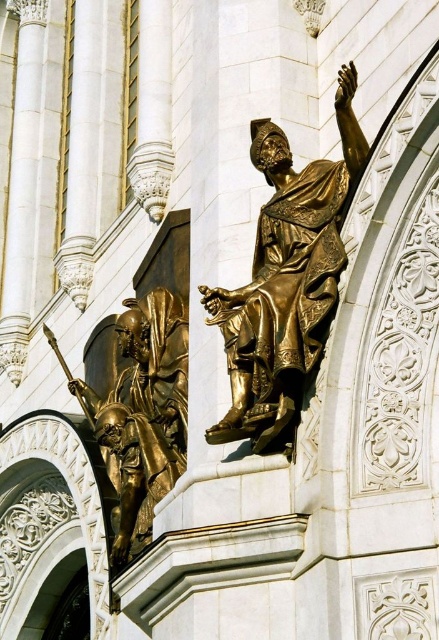
Is shiny gold statue at center to the left of gold-bronze statue at center from the viewer's perspective?

In fact, shiny gold statue at center is to the right of gold-bronze statue at center.

Who is shorter, shiny gold statue at center or gold-bronze statue at center?

Standing shorter between the two is gold-bronze statue at center.

I want to click on shiny gold statue at center, so click(x=285, y=280).

At what (x,y) coordinates should I click in order to perform the action: click on shiny gold statue at center. Please return your answer as a coordinate pair (x, y). The width and height of the screenshot is (439, 640). Looking at the image, I should click on (285, 280).